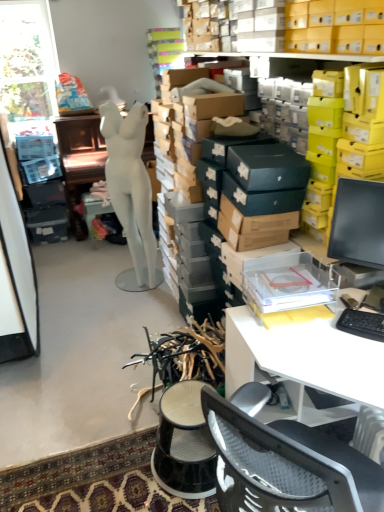
Question: Is black plastic stool at center shorter than transparent glass window at upper left?

Choices:
 (A) no
 (B) yes

Answer: (B)

Question: Would you say black plastic stool at center contains transparent glass window at upper left?

Choices:
 (A) no
 (B) yes

Answer: (A)

Question: From a real-world perspective, is black plastic stool at center below transparent glass window at upper left?

Choices:
 (A) no
 (B) yes

Answer: (B)

Question: Is black plastic stool at center taller than transparent glass window at upper left?

Choices:
 (A) yes
 (B) no

Answer: (B)

Question: Is black plastic stool at center turned away from transparent glass window at upper left?

Choices:
 (A) yes
 (B) no

Answer: (B)

Question: From a real-world perspective, is black plastic stool at center on top of transparent glass window at upper left?

Choices:
 (A) yes
 (B) no

Answer: (B)

Question: Considering the relative sizes of black plastic keyboard at right and black plastic stool at center in the image provided, is black plastic keyboard at right shorter than black plastic stool at center?

Choices:
 (A) yes
 (B) no

Answer: (A)

Question: Is black plastic keyboard at right taller than black plastic stool at center?

Choices:
 (A) yes
 (B) no

Answer: (B)

Question: From a real-world perspective, does black plastic keyboard at right stand above black plastic stool at center?

Choices:
 (A) yes
 (B) no

Answer: (A)

Question: Does black plastic keyboard at right appear on the right side of black plastic stool at center?

Choices:
 (A) yes
 (B) no

Answer: (A)

Question: Can you confirm if black plastic keyboard at right is thinner than black plastic stool at center?

Choices:
 (A) yes
 (B) no

Answer: (A)

Question: Does black plastic keyboard at right have a smaller size compared to black plastic stool at center?

Choices:
 (A) yes
 (B) no

Answer: (A)

Question: Considering the relative positions of transparent glass window at upper left and white matte mannequin at center in the image provided, is transparent glass window at upper left to the left of white matte mannequin at center from the viewer's perspective?

Choices:
 (A) no
 (B) yes

Answer: (B)